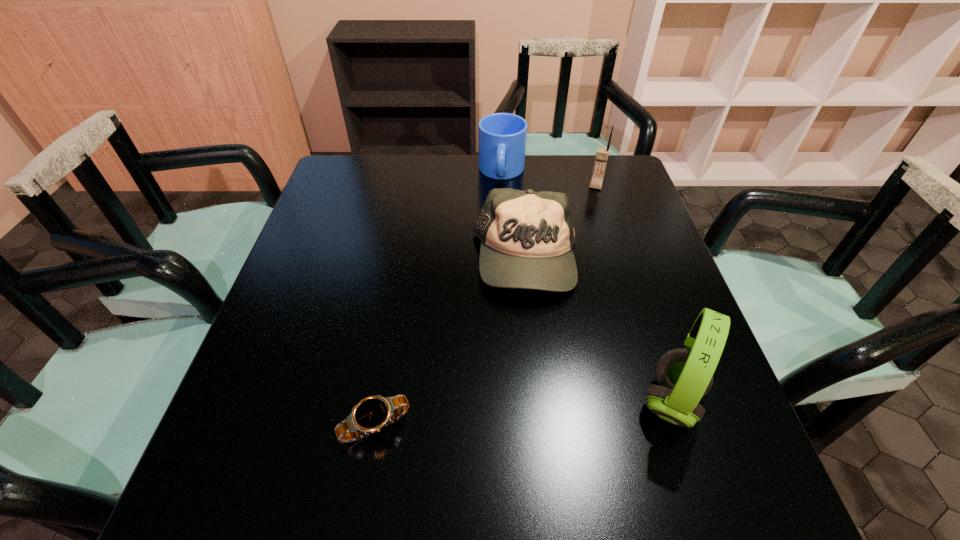
Locate an element on the screen. watch that is at the near edge is located at coordinates (371, 414).

Locate an element on the screen. headset that is at the near edge is located at coordinates (684, 376).

You are a GUI agent. You are given a task and a screenshot of the screen. Output one action in this format:
    pyautogui.click(x=<x>, y=<y>)
    Task: Click on the headset present at the right edge
    
    Given the screenshot: What is the action you would take?
    pyautogui.click(x=684, y=376)

The width and height of the screenshot is (960, 540). I want to click on cellular telephone situated at the right edge, so click(x=602, y=154).

Locate an element on the screen. This screenshot has height=540, width=960. object present at the far right corner is located at coordinates (602, 154).

You are a GUI agent. You are given a task and a screenshot of the screen. Output one action in this format:
    pyautogui.click(x=<x>, y=<y>)
    Task: Click on the object that is at the near right corner
    This screenshot has height=540, width=960.
    Given the screenshot: What is the action you would take?
    pyautogui.click(x=684, y=376)

Identify the location of free space at the far edge of the desktop. This screenshot has width=960, height=540. (425, 178).

The image size is (960, 540). In the image, there is a desktop. Identify the location of vacant space at the near edge. (348, 416).

Identify the location of free space at the left edge of the desktop. (359, 233).

Image resolution: width=960 pixels, height=540 pixels. Find the location of `vacant space at the right edge of the desktop`. vacant space at the right edge of the desktop is located at coordinates (660, 264).